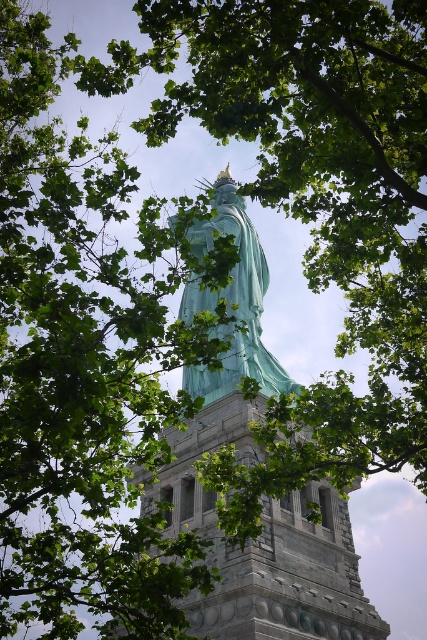
Question: Among these objects, which one is nearest to the camera?

Choices:
 (A) green patina statue at center
 (B) green stone tower at center

Answer: (B)

Question: Is green stone tower at center closer to the viewer compared to green patina statue at center?

Choices:
 (A) no
 (B) yes

Answer: (B)

Question: Which object is closer to the camera taking this photo?

Choices:
 (A) green patina statue at center
 (B) green stone tower at center

Answer: (B)

Question: Does green stone tower at center appear under green patina statue at center?

Choices:
 (A) no
 (B) yes

Answer: (B)

Question: Does green stone tower at center appear over green patina statue at center?

Choices:
 (A) yes
 (B) no

Answer: (B)

Question: Among these points, which one is farthest from the camera?

Choices:
 (A) coord(222,221)
 (B) coord(327,529)

Answer: (A)